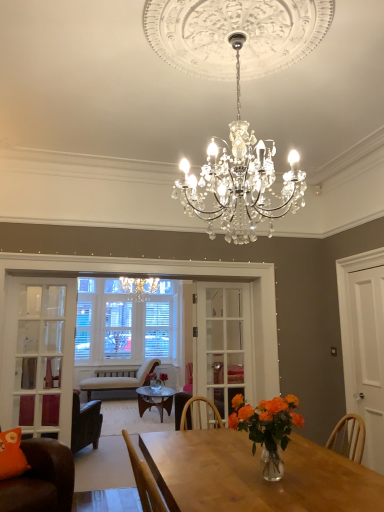
This screenshot has height=512, width=384. What do you see at coordinates (39, 356) in the screenshot?
I see `white glass door at left, arranged as the 2th glass door when viewed from the right` at bounding box center [39, 356].

What is the approximate width of clear glass door at center, acting as the 2th glass door starting from the front?

clear glass door at center, acting as the 2th glass door starting from the front, is 4.46 centimeters in width.

The image size is (384, 512). What are the coordinates of `orange fabric pillow at lower left` in the screenshot? It's located at (x=12, y=454).

The image size is (384, 512). I want to click on white matte door at right, so click(x=369, y=357).

Where is `orange matte vase at center`? The image size is (384, 512). orange matte vase at center is located at coordinates (267, 428).

Locate an element on the screen. This screenshot has height=512, width=384. brown leather chair at lower left, which is the first chair in front-to-back order is located at coordinates (41, 479).

From the image's perspective, is clear glass door at center, which is the 1th glass door in right-to-left order, over white glass door at left, arranged as the 2th glass door when viewed from the right?

Yes, from the image's perspective, clear glass door at center, which is the 1th glass door in right-to-left order, is over white glass door at left, arranged as the 2th glass door when viewed from the right.

Which is behind, point (227, 392) or point (56, 398)?

The point (227, 392) is behind.

Are clear glass door at center, which is the 1th glass door in right-to-left order, and white glass door at left, which is counted as the first glass door, starting from the front, beside each other?

clear glass door at center, which is the 1th glass door in right-to-left order, and white glass door at left, which is counted as the first glass door, starting from the front, are clearly separated.

Is orange matte vase at center oriented towards white glass door at left, arranged as the 2th glass door when viewed from the right?

No, orange matte vase at center is not oriented towards white glass door at left, arranged as the 2th glass door when viewed from the right.

From the image's perspective, is orange matte vase at center above or below white glass door at left, arranged as the 2th glass door when viewed from the right?

orange matte vase at center is above white glass door at left, arranged as the 2th glass door when viewed from the right.

Is point (233, 419) less distant than point (45, 395)?

Yes, it is in front of point (45, 395).

Which object is more forward, orange matte vase at center or white glass door at left, arranged as the 2th glass door when viewed from the right?

orange matte vase at center is closer to the camera.

Locate an element on the screen. Image resolution: width=384 pixels, height=512 pixels. the 2nd chair to the left when counting from the clear glass door at center, acting as the 2th glass door starting from the front is located at coordinates (117, 382).

From a real-world perspective, which is physically above, light beige fabric chair at center, arranged as the 2th chair when viewed from the front, or clear glass door at center, which is the 2th glass door from left to right?

From a 3D spatial view, clear glass door at center, which is the 2th glass door from left to right, is above.

Which is in front, point (111, 388) or point (219, 348)?

The point (219, 348) is in front.

Consider the image. Is the position of light beige fabric chair at center, the second chair in the top-to-bottom sequence, more distant than that of clear glass door at center, acting as the 2th glass door starting from the front?

That is True.

From the image's perspective, is clear glass door at center, which is the 2th glass door from left to right, on orange matte vase at center?

No, from the image's perspective, clear glass door at center, which is the 2th glass door from left to right, is not over orange matte vase at center.

From the picture: Relative to orange matte vase at center, is clear glass door at center, which is the 2th glass door from left to right, in front or behind?

clear glass door at center, which is the 2th glass door from left to right, is behind orange matte vase at center.

Between clear glass door at center, acting as the 2th glass door starting from the front, and orange matte vase at center, which one appears on the left side from the viewer's perspective?

From the viewer's perspective, clear glass door at center, acting as the 2th glass door starting from the front, appears more on the left side.

Is clear glass door at center, acting as the 2th glass door starting from the front, completely or partially outside of orange matte vase at center?

Yes, clear glass door at center, acting as the 2th glass door starting from the front, is located beyond the bounds of orange matte vase at center.

Considering the sizes of orange fabric pillow at lower left and white glass door at left, which is counted as the first glass door, starting from the front, in the image, is orange fabric pillow at lower left taller or shorter than white glass door at left, which is counted as the first glass door, starting from the front,?

Clearly, orange fabric pillow at lower left is shorter compared to white glass door at left, which is counted as the first glass door, starting from the front.

Can white glass door at left, arranged as the 1th glass door when viewed from the left, be found inside orange fabric pillow at lower left?

No.

Could you tell me if orange fabric pillow at lower left is turned towards white glass door at left, arranged as the 1th glass door when viewed from the left?

No, orange fabric pillow at lower left is not oriented towards white glass door at left, arranged as the 1th glass door when viewed from the left.

Does orange fabric pillow at lower left come behind white glass door at left, arranged as the 1th glass door when viewed from the left?

No, orange fabric pillow at lower left is closer to the viewer.

Which is behind, point (21, 469) or point (101, 391)?

The point (101, 391) is more distant.

Which object is further away from the camera taking this photo, orange fabric pillow at lower left or light beige fabric chair at center, marked as the 1th chair in a back-to-front arrangement?

light beige fabric chair at center, marked as the 1th chair in a back-to-front arrangement, is further from the camera.

Is light beige fabric chair at center, placed as the 1th chair when sorted from bottom to top, inside orange fabric pillow at lower left?

No, light beige fabric chair at center, placed as the 1th chair when sorted from bottom to top, is not a part of orange fabric pillow at lower left.

From the image's perspective, which one is positioned lower, orange fabric pillow at lower left or light beige fabric chair at center, the second chair in the top-to-bottom sequence?

light beige fabric chair at center, the second chair in the top-to-bottom sequence, is shown below in the image.

Considering their positions, is white matte door at right located in front of or behind orange matte vase at center?

Visually, white matte door at right is located behind orange matte vase at center.

Is white matte door at right bigger than orange matte vase at center?

Yes.

In the scene shown: How many degrees apart are the facing directions of white matte door at right and orange matte vase at center?

The facing directions of white matte door at right and orange matte vase at center are 88.8 degrees apart.

Does white matte door at right touch orange matte vase at center?

No, white matte door at right is not making contact with orange matte vase at center.

Where is `glass door above the white glass door at left, which is counted as the first glass door, starting from the front (from a real-world perspective)`? The height and width of the screenshot is (512, 384). glass door above the white glass door at left, which is counted as the first glass door, starting from the front (from a real-world perspective) is located at coordinates (223, 343).

The image size is (384, 512). Find the location of `floral arrangement below the white glass door at left, which is the second glass door in back-to-front order (from a real-world perspective)`. floral arrangement below the white glass door at left, which is the second glass door in back-to-front order (from a real-world perspective) is located at coordinates (267, 428).

Considering their positions, is orange matte vase at center positioned closer to clear glass door at center, placed as the 1th glass door when sorted from back to front, than white glass door at left, arranged as the 2th glass door when viewed from the right?

white glass door at left, arranged as the 2th glass door when viewed from the right, lies closer to clear glass door at center, placed as the 1th glass door when sorted from back to front, than the other object.

Which object lies nearer to the anchor point clear glass door at center, placed as the 1th glass door when sorted from back to front, white glass door at left, arranged as the 1th glass door when viewed from the left, or orange matte vase at center?

Among the two, white glass door at left, arranged as the 1th glass door when viewed from the left, is located nearer to clear glass door at center, placed as the 1th glass door when sorted from back to front.

Estimate the real-world distances between objects in this image. Which object is closer to orange matte vase at center, clear glass door at center, placed as the 1th glass door when sorted from back to front, or light beige fabric chair at center, arranged as the 2th chair when viewed from the front?

clear glass door at center, placed as the 1th glass door when sorted from back to front, lies closer to orange matte vase at center than the other object.

From the image, which object appears to be farther from brown leather chair at lower left, which is counted as the second chair, starting from the bottom, orange fabric pillow at lower left or clear glass door at center, which is the 2th glass door from left to right?

clear glass door at center, which is the 2th glass door from left to right, is positioned further to the anchor brown leather chair at lower left, which is counted as the second chair, starting from the bottom.

From the image, which object appears to be nearer to clear glass door at center, placed as the 1th glass door when sorted from back to front, light beige fabric chair at center, placed as the 1th chair when sorted from bottom to top, or orange fabric pillow at lower left?

orange fabric pillow at lower left lies closer to clear glass door at center, placed as the 1th glass door when sorted from back to front, than the other object.

Considering their positions, is orange fabric pillow at lower left positioned further to brown leather chair at lower left, which is counted as the second chair, starting from the bottom, than white glass door at left, arranged as the 2th glass door when viewed from the right?

white glass door at left, arranged as the 2th glass door when viewed from the right, is positioned further to the anchor brown leather chair at lower left, which is counted as the second chair, starting from the bottom.

Which object lies nearer to the anchor point orange matte vase at center, light beige fabric chair at center, marked as the 1th chair in a back-to-front arrangement, or clear glass door at center, which is the 2th glass door from left to right?

clear glass door at center, which is the 2th glass door from left to right, is positioned closer to the anchor orange matte vase at center.

From the image, which object appears to be nearer to white glass door at left, which is the second glass door in back-to-front order, orange matte vase at center or white matte door at right?

orange matte vase at center is closer to white glass door at left, which is the second glass door in back-to-front order.

Find the location of a particular element. Image resolution: width=384 pixels, height=512 pixels. chair between orange matte vase at center and white glass door at left, arranged as the 1th glass door when viewed from the left, along the z-axis is located at coordinates (41, 479).

Where is `door located between orange fabric pillow at lower left and light beige fabric chair at center, placed as the 1th chair when sorted from bottom to top, in the depth direction`? The image size is (384, 512). door located between orange fabric pillow at lower left and light beige fabric chair at center, placed as the 1th chair when sorted from bottom to top, in the depth direction is located at coordinates (369, 357).

Locate an element on the screen. chair between orange matte vase at center and clear glass door at center, acting as the 2th glass door starting from the front, in the front-back direction is located at coordinates (41, 479).

Identify the location of chair between orange matte vase at center and light beige fabric chair at center, arranged as the 2th chair when viewed from the front, from front to back. (41, 479).